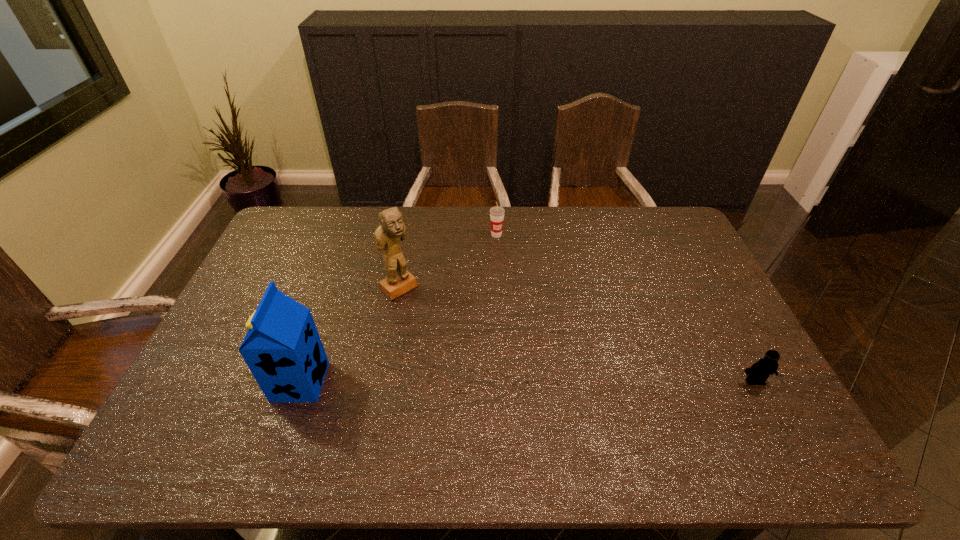
You are a GUI agent. You are given a task and a screenshot of the screen. Output one action in this format:
    pyautogui.click(x=<x>, y=<y>)
    Task: Click on the vacant space on the desktop that is between the carton and the shortest object and is positioned on the front-facing side of the figurine
    The height and width of the screenshot is (540, 960).
    Given the screenshot: What is the action you would take?
    pyautogui.click(x=506, y=381)

Locate an element on the screen. Image resolution: width=960 pixels, height=540 pixels. vacant space on the desktop that is between the carton and the rightmost object and is positioned on the side of the third tallest object with the logo is located at coordinates (579, 381).